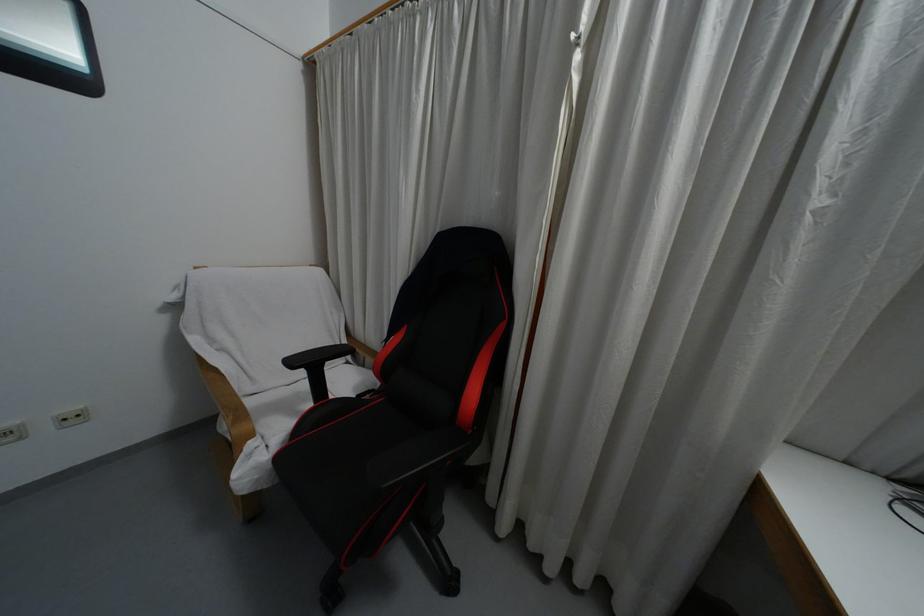
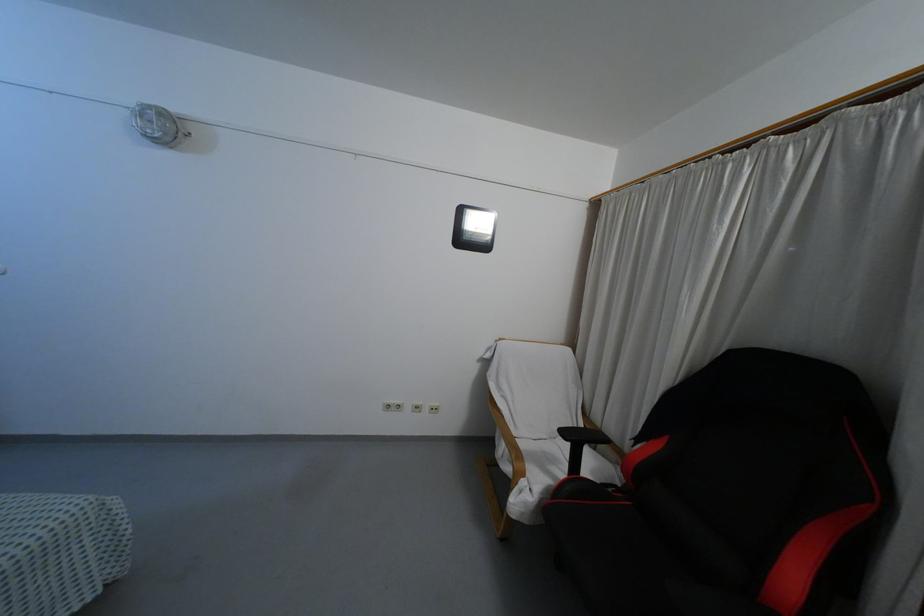
Locate, in the second image, the point that corresponds to point (368, 360) in the first image.

(600, 446)